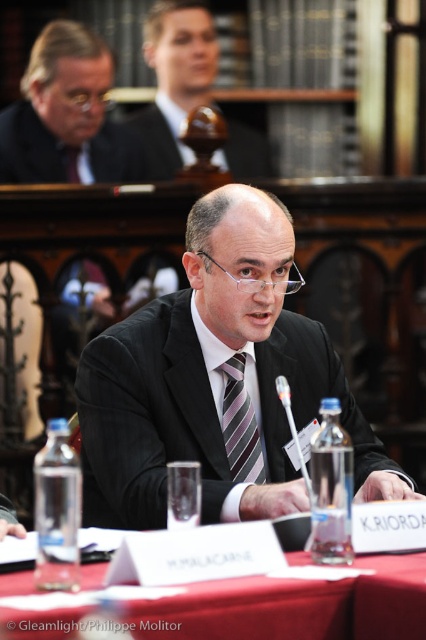
Question: Which object appears farthest from the camera in this image?

Choices:
 (A) matte black suit at upper center
 (B) striped silk tie at center

Answer: (A)

Question: Is matte black suit at upper left smaller than matte black suit at upper center?

Choices:
 (A) yes
 (B) no

Answer: (B)

Question: Which object appears farthest from the camera in this image?

Choices:
 (A) black matte suit at center
 (B) matte black suit at upper left
 (C) matte brown wooden object at upper center
 (D) matte black suit at upper center

Answer: (D)

Question: Which object is farther from the camera taking this photo?

Choices:
 (A) black matte suit at center
 (B) matte brown wooden object at upper center
 (C) matte black suit at upper left

Answer: (B)

Question: Where is black matte suit at center located in relation to matte black suit at upper left in the image?

Choices:
 (A) right
 (B) left

Answer: (A)

Question: Can you confirm if black matte suit at center is positioned below striped silk tie at center?

Choices:
 (A) yes
 (B) no

Answer: (B)